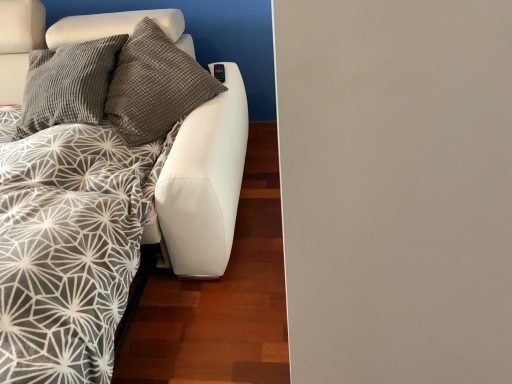
The image size is (512, 384). I want to click on white leather couch at left, so click(x=106, y=230).

Describe the element at coordinates (106, 230) in the screenshot. I see `white leather couch at left` at that location.

Identify the location of textured gray pillows at upper left. This screenshot has height=384, width=512. (209, 37).

This screenshot has height=384, width=512. Describe the element at coordinates (209, 37) in the screenshot. I see `textured gray pillows at upper left` at that location.

The height and width of the screenshot is (384, 512). I want to click on white leather couch at left, so click(x=106, y=230).

Is textured gray pillows at upper left at the left side of white leather couch at left?

No, textured gray pillows at upper left is not to the left of white leather couch at left.

Which is in front, textured gray pillows at upper left or white leather couch at left?

white leather couch at left is more forward.

Which point is more forward, (220,25) or (28,238)?

The point (28,238) is in front.

From the image's perspective, is textured gray pillows at upper left above white leather couch at left?

Indeed, from the image's perspective, textured gray pillows at upper left is shown above white leather couch at left.

From a real-world perspective, relative to white leather couch at left, is textured gray pillows at upper left vertically above or below?

textured gray pillows at upper left is situated higher than white leather couch at left in the real world.

Considering the relative sizes of textured gray pillows at upper left and white leather couch at left in the image provided, is textured gray pillows at upper left wider than white leather couch at left?

No, textured gray pillows at upper left is not wider than white leather couch at left.

In terms of height, does textured gray pillows at upper left look taller or shorter compared to white leather couch at left?

In the image, textured gray pillows at upper left appears to be shorter than white leather couch at left.

Is textured gray pillows at upper left bigger than white leather couch at left?

Incorrect, textured gray pillows at upper left is not larger than white leather couch at left.

Would you say textured gray pillows at upper left contains white leather couch at left?

No, white leather couch at left is located outside of textured gray pillows at upper left.

Based on the photo, can you see textured gray pillows at upper left touching white leather couch at left?

There is a gap between textured gray pillows at upper left and white leather couch at left.

Is textured gray pillows at upper left positioned with its back to white leather couch at left?

Absolutely, textured gray pillows at upper left is directed away from white leather couch at left.

Can you tell me how much textured gray pillows at upper left and white leather couch at left differ in facing direction?

44.1 degrees separate the facing orientations of textured gray pillows at upper left and white leather couch at left.

How much distance is there between textured gray pillows at upper left and white leather couch at left?

textured gray pillows at upper left and white leather couch at left are 26.23 inches apart.

I want to click on furniture in front of the textured gray pillows at upper left, so click(x=106, y=230).

In the image, is white leather couch at left on the left side or the right side of textured gray pillows at upper left?

white leather couch at left is to the left of textured gray pillows at upper left.

Is white leather couch at left in front of or behind textured gray pillows at upper left in the image?

white leather couch at left is in front of textured gray pillows at upper left.

Considering the positions of point (35, 6) and point (236, 33), is point (35, 6) closer or farther from the camera than point (236, 33)?

Point (35, 6).

From the image's perspective, is white leather couch at left located above or below textured gray pillows at upper left?

From the image's perspective, white leather couch at left appears below textured gray pillows at upper left.

From a real-world perspective, is white leather couch at left above or below textured gray pillows at upper left?

white leather couch at left is situated lower than textured gray pillows at upper left in the real world.

Can you confirm if white leather couch at left is wider than textured gray pillows at upper left?

Yes, white leather couch at left is wider than textured gray pillows at upper left.

Between white leather couch at left and textured gray pillows at upper left, which one has less height?

With less height is textured gray pillows at upper left.

Considering the sizes of objects white leather couch at left and textured gray pillows at upper left in the image provided, who is bigger, white leather couch at left or textured gray pillows at upper left?

white leather couch at left is bigger.

Can textured gray pillows at upper left be found inside white leather couch at left?

Absolutely, textured gray pillows at upper left is inside white leather couch at left.

Is white leather couch at left beside textured gray pillows at upper left?

No, white leather couch at left is not beside textured gray pillows at upper left.

Is white leather couch at left aimed at textured gray pillows at upper left?

No, white leather couch at left is not turned towards textured gray pillows at upper left.

The height and width of the screenshot is (384, 512). What are the coordinates of `furniture below the textured gray pillows at upper left (from the image's perspective)` in the screenshot? It's located at (106, 230).

Where is `furniture below the textured gray pillows at upper left (from the image's perspective)`? This screenshot has width=512, height=384. furniture below the textured gray pillows at upper left (from the image's perspective) is located at coordinates (106, 230).

In order to click on furniture directly beneath the textured gray pillows at upper left (from a real-world perspective) in this screenshot , I will do `click(106, 230)`.